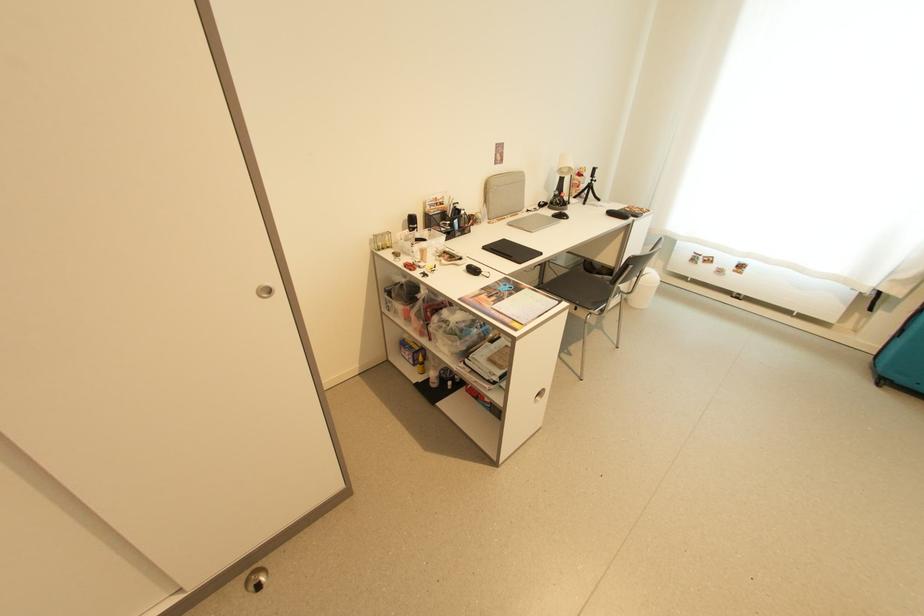
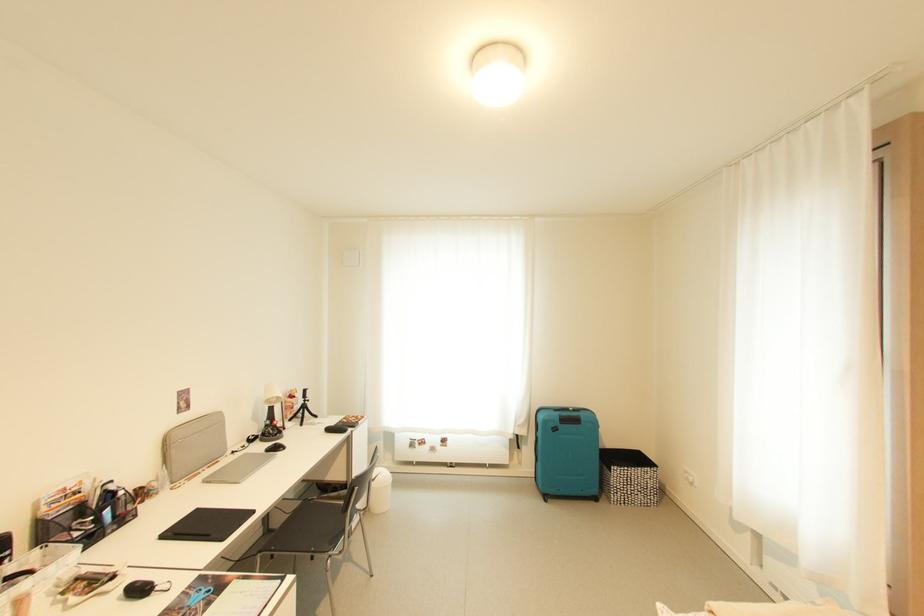
Find the pixel in the second image that matches point 495,197 in the first image.

(177, 455)